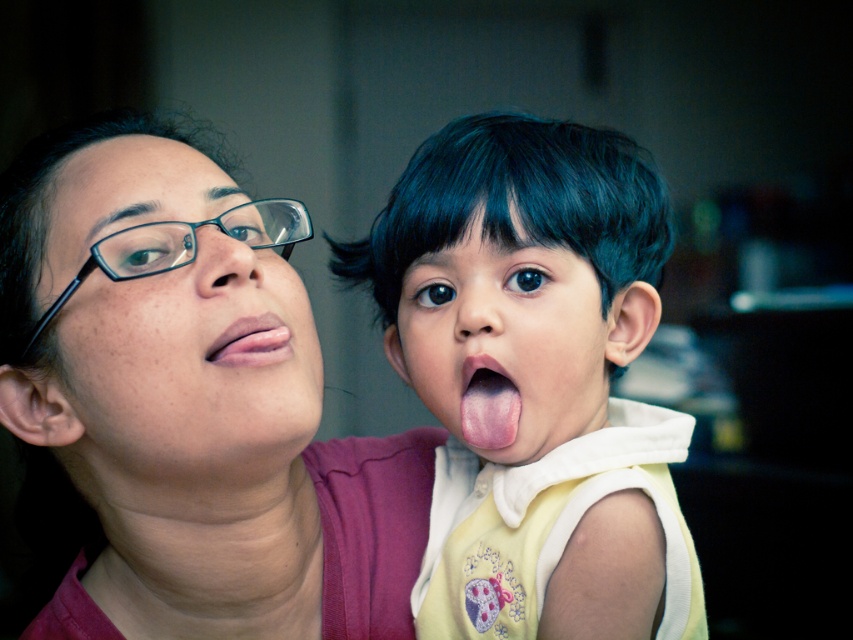
Question: Can you confirm if matte pink shirt at upper left is positioned to the right of smooth skin face at center?

Choices:
 (A) no
 (B) yes

Answer: (A)

Question: Does pink smooth tongue at center have a greater width compared to pink flesh-colored lips at center?

Choices:
 (A) yes
 (B) no

Answer: (B)

Question: Among these points, which one is farthest from the camera?

Choices:
 (A) (294, 320)
 (B) (64, 416)
 (C) (454, 636)
 (D) (262, 236)

Answer: (C)

Question: Based on their relative distances, which object is nearer to the smooth skin face at center?

Choices:
 (A) pink flesh-colored lips at center
 (B) smooth yellow shirt at center
 (C) matte black glasses at upper left

Answer: (B)

Question: Does smooth yellow shirt at center have a lesser width compared to black plastic glasses at upper left?

Choices:
 (A) yes
 (B) no

Answer: (B)

Question: Which point is farther from the camera taking this photo?

Choices:
 (A) (21, 355)
 (B) (222, 460)

Answer: (A)